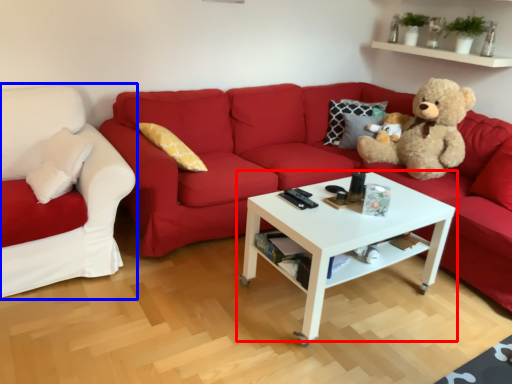
Question: Among these objects, which one is farthest to the camera, coffee table (highlighted by a red box) or studio couch (highlighted by a blue box)?

Choices:
 (A) coffee table
 (B) studio couch

Answer: (B)